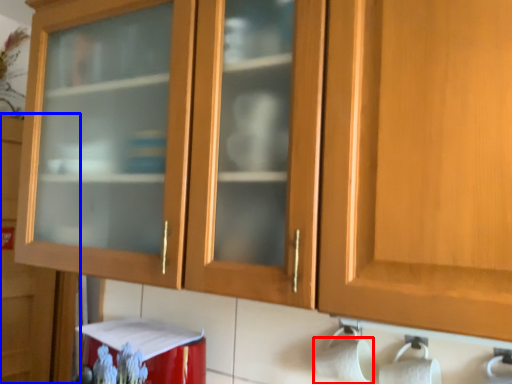
Question: Which point is closer to the camera, toilet paper (highlighted by a red box) or cupboard (highlighted by a blue box)?

Choices:
 (A) toilet paper
 (B) cupboard

Answer: (A)